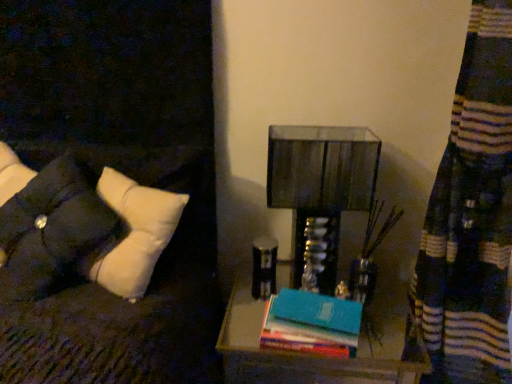
Question: Considering the relative sizes of wooden nightstand at lower right and white fabric pillow at left in the image provided, is wooden nightstand at lower right thinner than white fabric pillow at left?

Choices:
 (A) no
 (B) yes

Answer: (A)

Question: Does wooden nightstand at lower right have a greater width compared to white fabric pillow at left?

Choices:
 (A) yes
 (B) no

Answer: (A)

Question: Is wooden nightstand at lower right facing away from white fabric pillow at left?

Choices:
 (A) yes
 (B) no

Answer: (B)

Question: Considering the relative sizes of wooden nightstand at lower right and white fabric pillow at left in the image provided, is wooden nightstand at lower right shorter than white fabric pillow at left?

Choices:
 (A) yes
 (B) no

Answer: (B)

Question: Considering the relative positions of wooden nightstand at lower right and white fabric pillow at left in the image provided, is wooden nightstand at lower right behind white fabric pillow at left?

Choices:
 (A) yes
 (B) no

Answer: (A)

Question: Is wooden nightstand at lower right not close to white fabric pillow at left?

Choices:
 (A) yes
 (B) no

Answer: (B)

Question: Are metallic glass table lamp at center and wooden nightstand at lower right beside each other?

Choices:
 (A) no
 (B) yes

Answer: (A)

Question: Does metallic glass table lamp at center appear on the right side of wooden nightstand at lower right?

Choices:
 (A) no
 (B) yes

Answer: (B)

Question: From a real-world perspective, is metallic glass table lamp at center beneath wooden nightstand at lower right?

Choices:
 (A) yes
 (B) no

Answer: (B)

Question: Is metallic glass table lamp at center to the left of wooden nightstand at lower right from the viewer's perspective?

Choices:
 (A) yes
 (B) no

Answer: (B)

Question: Could you tell me if metallic glass table lamp at center is facing wooden nightstand at lower right?

Choices:
 (A) yes
 (B) no

Answer: (B)

Question: Is metallic glass table lamp at center positioned behind wooden nightstand at lower right?

Choices:
 (A) yes
 (B) no

Answer: (A)

Question: From the image's perspective, would you say tufted fabric pillow at left is shown under wooden nightstand at lower right?

Choices:
 (A) no
 (B) yes

Answer: (A)